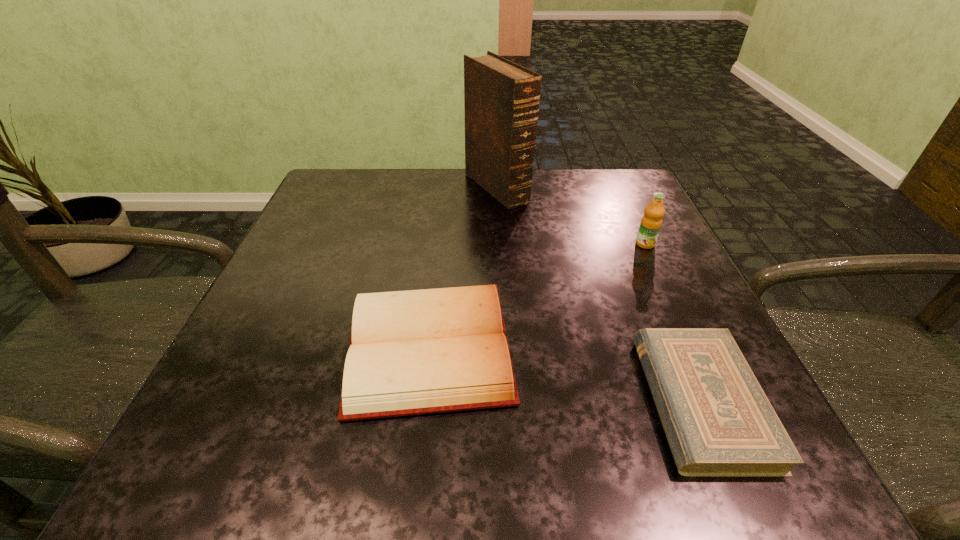
Identify the location of vacant space at the far right corner. (606, 171).

Image resolution: width=960 pixels, height=540 pixels. In order to click on vacant space at the near right corner of the desktop in this screenshot , I will do (x=657, y=436).

This screenshot has height=540, width=960. Identify the location of blank region between the shortest object and the tallest object. (599, 294).

Identify the location of unoccupied area between the tallest object and the shortest object. (599, 294).

Find the location of `free space between the tallest object and the third shortest object`. free space between the tallest object and the third shortest object is located at coordinates (571, 215).

Where is `the third closest object to the second farthest object`? This screenshot has height=540, width=960. the third closest object to the second farthest object is located at coordinates (414, 352).

Select which object appears as the closest to the rightmost Bible. Please provide its 2D coordinates. Your answer should be formatted as a tuple, i.e. [(x, y)], where the tuple contains the x and y coordinates of a point satisfying the conditions above.

[(414, 352)]

What are the coordinates of `the second closest Bible to the third shortest object` in the screenshot? It's located at (718, 421).

Where is `Bible that is the second closest to the second farthest object`? The height and width of the screenshot is (540, 960). Bible that is the second closest to the second farthest object is located at coordinates (718, 421).

At what (x,y) coordinates should I click in order to perform the action: click on blank space that satisfies the following two spatial constraints: 1. on the label of the orange juice; 2. on the spine side of the shortest object. Please return your answer as a coordinate pair (x, y). Looking at the image, I should click on (719, 401).